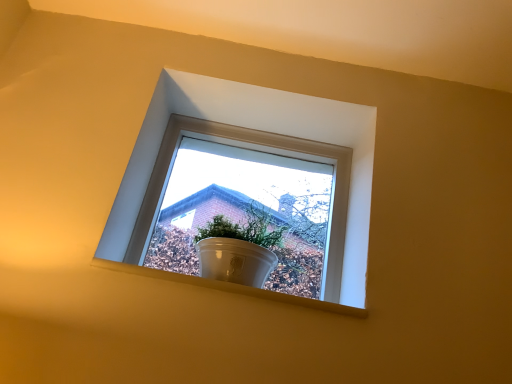
Question: Is white glossy pot at upper center facing away from white glossy pot at center?

Choices:
 (A) no
 (B) yes

Answer: (B)

Question: Is white glossy pot at upper center located outside white glossy pot at center?

Choices:
 (A) no
 (B) yes

Answer: (B)

Question: Does white glossy pot at upper center appear on the right side of white glossy pot at center?

Choices:
 (A) no
 (B) yes

Answer: (A)

Question: Does white glossy pot at upper center have a larger size compared to white glossy pot at center?

Choices:
 (A) no
 (B) yes

Answer: (A)

Question: Is white glossy pot at upper center beside white glossy pot at center?

Choices:
 (A) no
 (B) yes

Answer: (A)

Question: Does white glossy pot at upper center have a lesser width compared to white glossy pot at center?

Choices:
 (A) yes
 (B) no

Answer: (A)

Question: Is white smooth window sill at center wider than white glossy pot at center?

Choices:
 (A) yes
 (B) no

Answer: (B)

Question: Does white smooth window sill at center lie behind white glossy pot at center?

Choices:
 (A) yes
 (B) no

Answer: (A)

Question: Is white smooth window sill at center taller than white glossy pot at center?

Choices:
 (A) no
 (B) yes

Answer: (A)

Question: Can you confirm if white smooth window sill at center is bigger than white glossy pot at center?

Choices:
 (A) yes
 (B) no

Answer: (B)

Question: From a real-world perspective, is white smooth window sill at center physically above white glossy pot at center?

Choices:
 (A) yes
 (B) no

Answer: (B)

Question: Is white smooth window sill at center oriented away from white glossy pot at center?

Choices:
 (A) yes
 (B) no

Answer: (B)

Question: Considering the relative positions of white glossy pot at upper center and white smooth window sill at center in the image provided, is white glossy pot at upper center in front of white smooth window sill at center?

Choices:
 (A) no
 (B) yes

Answer: (A)